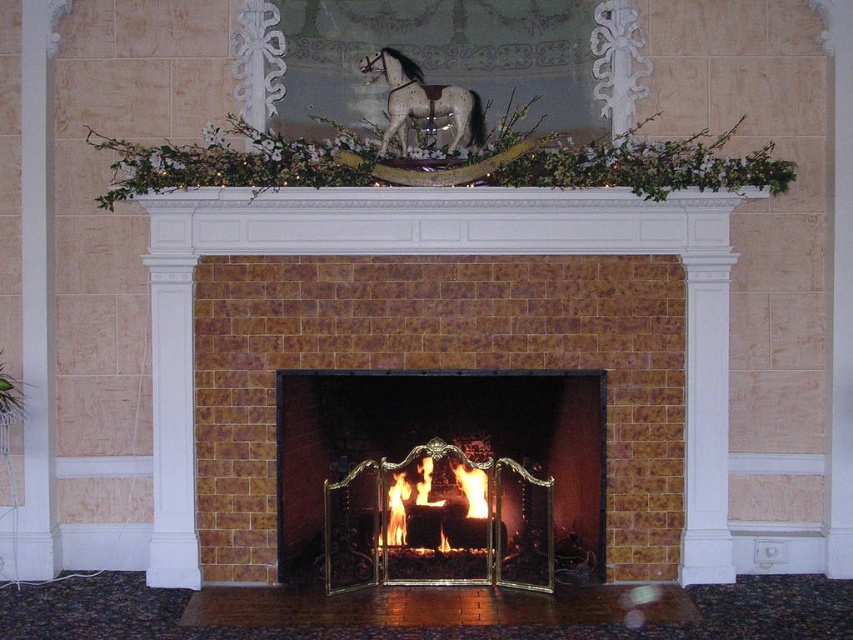
Question: From the image, what is the correct spatial relationship of flaming wood at center in relation to speckled gray horse at upper center?

Choices:
 (A) below
 (B) above

Answer: (A)

Question: Is brown brick fireplace at center closer to the viewer compared to speckled gray horse at upper center?

Choices:
 (A) no
 (B) yes

Answer: (B)

Question: Where is brown brick fireplace at center located in relation to speckled gray horse at upper center in the image?

Choices:
 (A) right
 (B) left

Answer: (A)

Question: Which object is farther from the camera taking this photo?

Choices:
 (A) speckled gray horse at upper center
 (B) brown brick fireplace at center
 (C) brass fireplace screen at center

Answer: (A)

Question: Which point is closer to the camera?

Choices:
 (A) brass fireplace screen at center
 (B) flaming wood at center
 (C) brown brick fireplace at center

Answer: (C)

Question: Which of these objects is positioned closest to the flaming wood at center?

Choices:
 (A) speckled gray horse at upper center
 (B) brass fireplace screen at center
 (C) brown brick fireplace at center

Answer: (B)